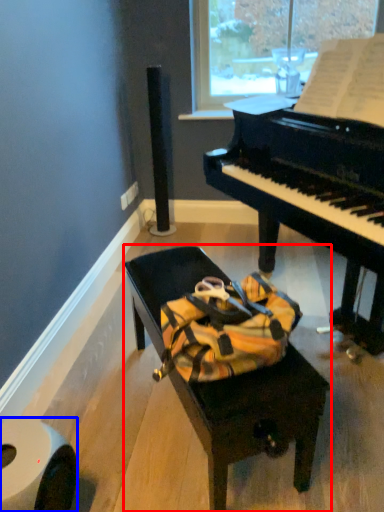
Question: Which object is further to the camera taking this photo, furniture (highlighted by a red box) or toilet paper (highlighted by a blue box)?

Choices:
 (A) furniture
 (B) toilet paper

Answer: (A)